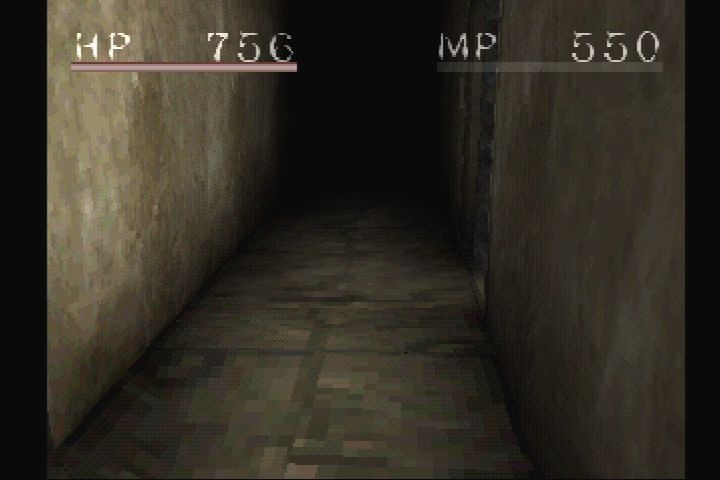
Where is `wall`? The image size is (720, 480). wall is located at coordinates (132, 134), (572, 150).